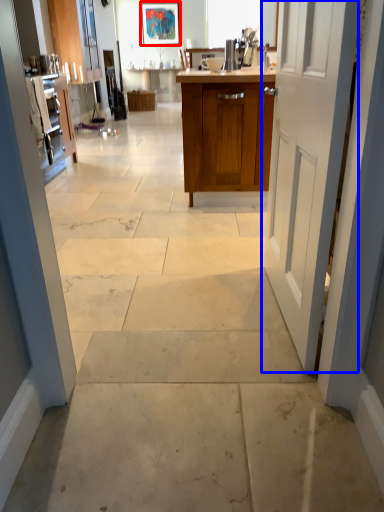
Question: Which object is further to the camera taking this photo, picture frame (highlighted by a red box) or door (highlighted by a blue box)?

Choices:
 (A) picture frame
 (B) door

Answer: (A)